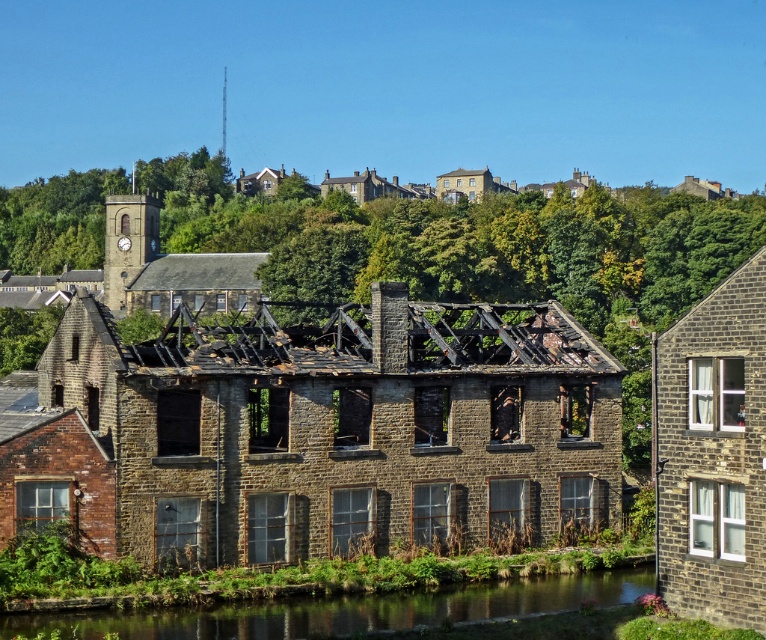
You are standing on the riverbank near the green grassy river at lower center. Looking at the brown stone building at center, can you see the river from the building?

The brown stone building at center is positioned over green grassy river at lower center, so yes, you can see the river from the building.

You are a city planner assessing the area for potential development. You see the brown stone building at center and the green grassy river at lower center. Which of these two features occupies a greater area in the scene?

The brown stone building at center is larger in size than the green grassy river at lower center, so the brown stone building at center occupies a greater area in the scene.